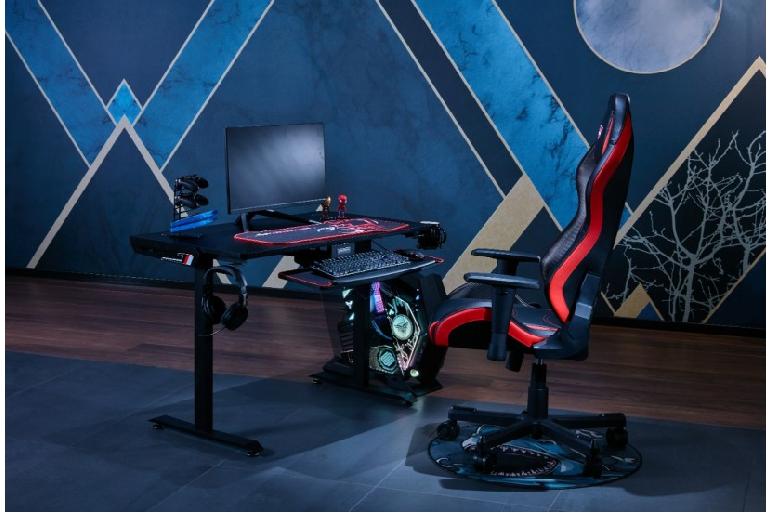
Identify the location of right arm rest. (511, 253).